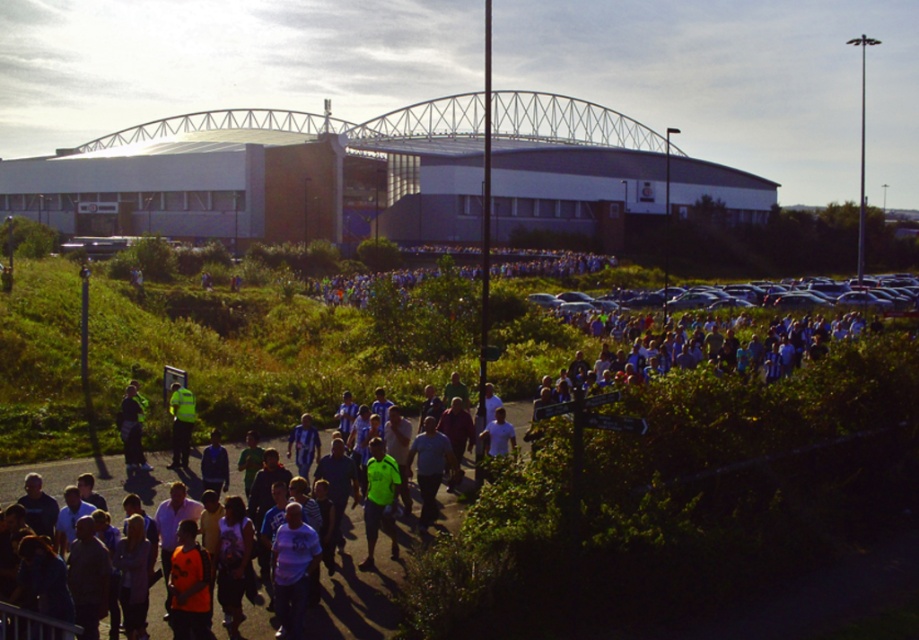
You are a photographer trying to capture a photo of the blue striped shirts at center and the neon green jersey at center. Which of the two objects should you focus on first if you want to ensure both are in frame without moving the camera?

The blue striped shirts at center should be focused on first because its width is larger than the neon green jersey at center, allowing more space to adjust the framing while keeping both in the shot.